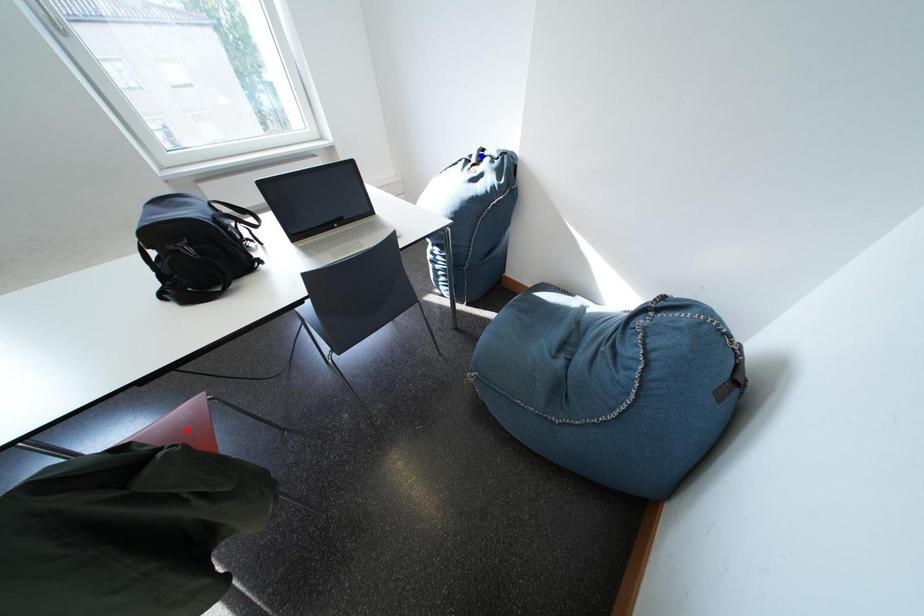
Question: Which of the two points in the image is closer to the camera?

Choices:
 (A) Blue point is closer.
 (B) Red point is closer.

Answer: (B)